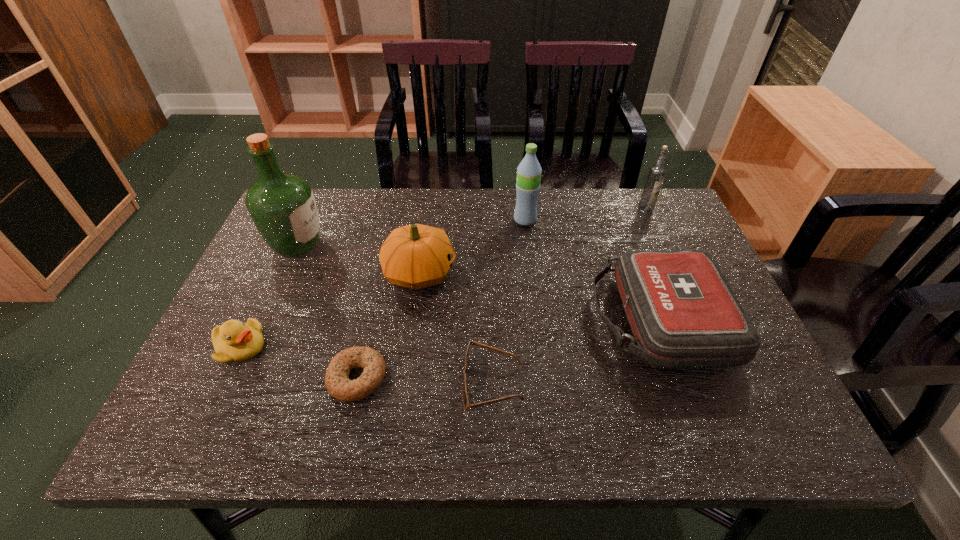
Where is `water bottle located in the far edge section of the desktop`? water bottle located in the far edge section of the desktop is located at coordinates (529, 170).

Image resolution: width=960 pixels, height=540 pixels. I want to click on vodka that is at the far edge, so click(656, 174).

At what (x,y) coordinates should I click in order to perform the action: click on sunglasses situated at the near edge. Please return your answer as a coordinate pair (x, y). Looking at the image, I should click on (466, 404).

At what (x,y) coordinates should I click in order to perform the action: click on bagel positioned at the near edge. Please return your answer as a coordinate pair (x, y). The width and height of the screenshot is (960, 540). Looking at the image, I should click on (337, 382).

At what (x,y) coordinates should I click in order to perform the action: click on liquor located at the left edge. Please return your answer as a coordinate pair (x, y). The height and width of the screenshot is (540, 960). Looking at the image, I should click on (282, 206).

In order to click on duckling positioned at the left edge in this screenshot , I will do `click(233, 341)`.

Find the location of a particular element. The height and width of the screenshot is (540, 960). vodka present at the right edge is located at coordinates (656, 174).

Where is `the first-aid kit that is at the right edge`? the first-aid kit that is at the right edge is located at coordinates (683, 314).

Where is `object present at the far left corner`? object present at the far left corner is located at coordinates (282, 206).

At what (x,y) coordinates should I click in order to perform the action: click on object positioned at the far right corner. Please return your answer as a coordinate pair (x, y). This screenshot has width=960, height=540. Looking at the image, I should click on (656, 174).